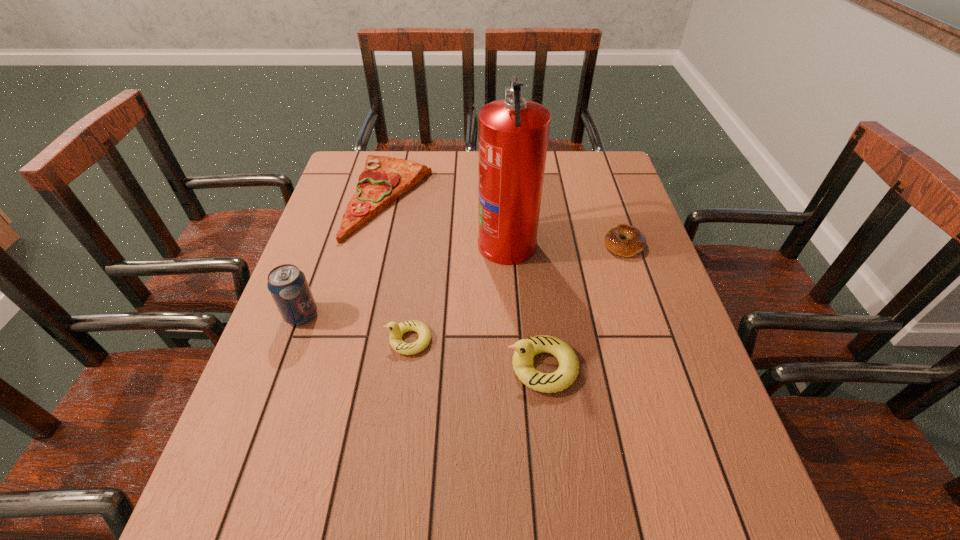
Identify the location of the fourth tallest object. (397, 330).

The height and width of the screenshot is (540, 960). Find the location of `the shorter duckling`. the shorter duckling is located at coordinates (397, 330).

Find the location of `the taller duckling`. the taller duckling is located at coordinates (525, 349).

Locate an element on the screen. The image size is (960, 540). the right duckling is located at coordinates (525, 349).

You are a GUI agent. You are given a task and a screenshot of the screen. Output one action in this format:
    pyautogui.click(x=<x>, y=<y>)
    Task: Click on the fifth tallest object
    The image size is (960, 540).
    Given the screenshot: What is the action you would take?
    pyautogui.click(x=383, y=180)

Locate an element on the screen. fire extinguisher is located at coordinates (513, 133).

I want to click on the rightmost object, so click(x=635, y=242).

Identify the location of the shortest object. coord(635,242).

Where is `pop soda`? This screenshot has height=540, width=960. pop soda is located at coordinates (288, 286).

The image size is (960, 540). Identify the location of vacant region located 0.140m on the face of the third shortest object. (324, 340).